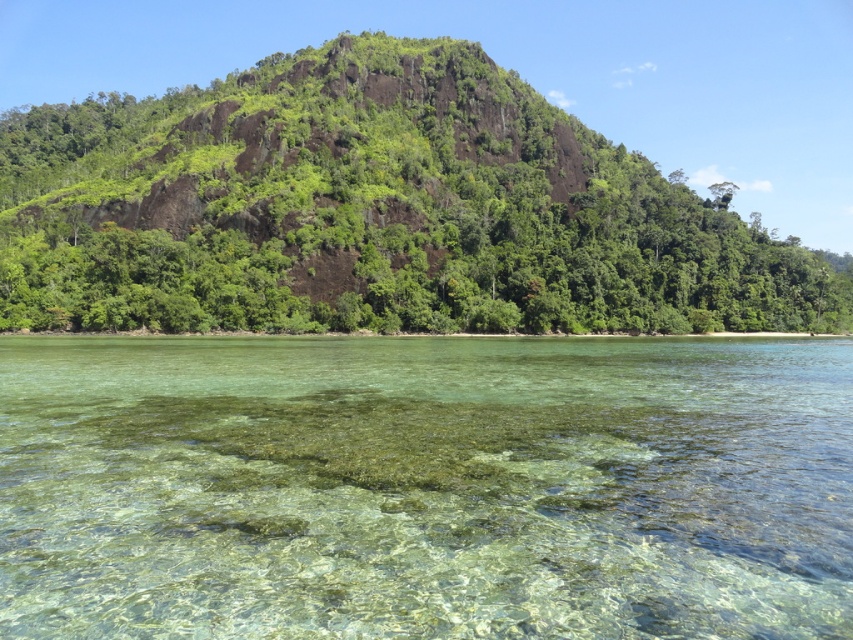
Question: Can you confirm if clear glassy water at center is bigger than green mossy rock at center?

Choices:
 (A) yes
 (B) no

Answer: (B)

Question: Is clear glassy water at center further to camera compared to green mossy rock at center?

Choices:
 (A) no
 (B) yes

Answer: (A)

Question: Which object appears farthest from the camera in this image?

Choices:
 (A) green mossy rock at center
 (B) clear glassy water at center

Answer: (A)

Question: Considering the relative positions of clear glassy water at center and green mossy rock at center in the image provided, where is clear glassy water at center located with respect to green mossy rock at center?

Choices:
 (A) left
 (B) right

Answer: (B)

Question: Among these objects, which one is nearest to the camera?

Choices:
 (A) green mossy rock at center
 (B) clear glassy water at center

Answer: (B)